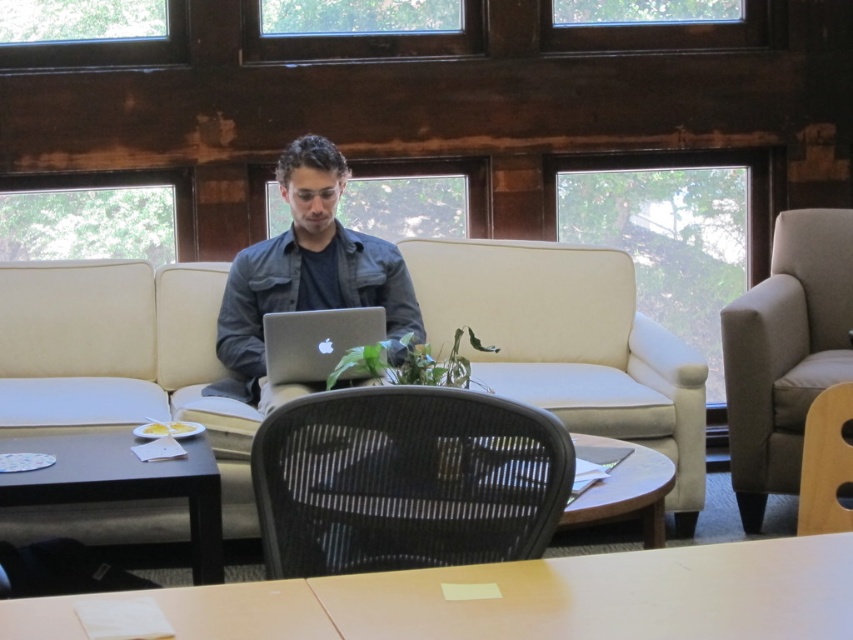
Question: Observing the image, what is the correct spatial positioning of beige fabric couch at center in reference to black mesh chair at center?

Choices:
 (A) left
 (B) right

Answer: (B)

Question: Which point appears farthest from the camera in this image?

Choices:
 (A) (840, 413)
 (B) (358, 259)
 (C) (549, 323)

Answer: (C)

Question: Does light brown wooden table at center lie in front of wooden chair at lower right?

Choices:
 (A) no
 (B) yes

Answer: (B)

Question: Which object is positioned closest to the gray fabric armchair at right?

Choices:
 (A) black wood table at lower left
 (B) light brown wooden table at center
 (C) matte black shirt at center
 (D) wooden chair at lower right

Answer: (D)

Question: Among these objects, which one is nearest to the camera?

Choices:
 (A) wooden chair at lower right
 (B) silver metallic laptop at center
 (C) light brown wooden table at center

Answer: (C)

Question: From the image, what is the correct spatial relationship of light brown wooden table at center in relation to matte black shirt at center?

Choices:
 (A) right
 (B) left

Answer: (A)